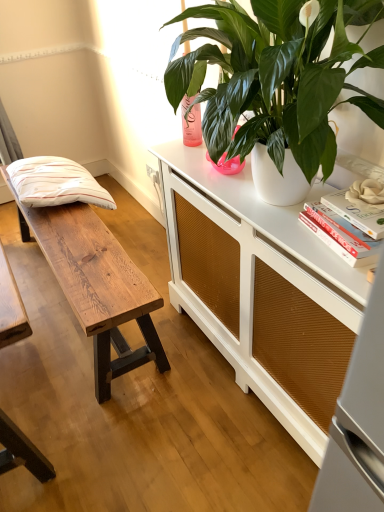
Find the location of `vacant area on top of white textured cabinet at center (from a real-world perspective)`. vacant area on top of white textured cabinet at center (from a real-world perspective) is located at coordinates (254, 194).